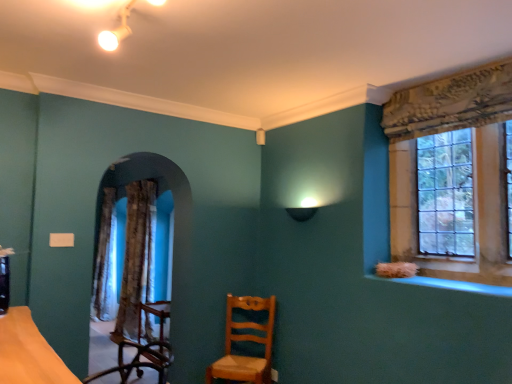
Question: Should I look upward or downward to see clear glass window at upper right?

Choices:
 (A) up
 (B) down

Answer: (B)

Question: Does light brown wood chair at center have a smaller size compared to textured brown curtain at left?

Choices:
 (A) yes
 (B) no

Answer: (A)

Question: Considering the relative sizes of light brown wood chair at center and textured brown curtain at left in the image provided, is light brown wood chair at center wider than textured brown curtain at left?

Choices:
 (A) yes
 (B) no

Answer: (A)

Question: Considering the relative positions of light brown wood chair at center and textured brown curtain at left in the image provided, is light brown wood chair at center to the left of textured brown curtain at left from the viewer's perspective?

Choices:
 (A) no
 (B) yes

Answer: (A)

Question: Would you consider light brown wood chair at center to be distant from textured brown curtain at left?

Choices:
 (A) no
 (B) yes

Answer: (A)

Question: Is the depth of light brown wood chair at center greater than that of textured brown curtain at left?

Choices:
 (A) no
 (B) yes

Answer: (A)

Question: Is the position of light brown wood chair at center less distant than that of textured brown curtain at left?

Choices:
 (A) no
 (B) yes

Answer: (B)

Question: Is light brown wood chair at center at the back of clear glass window at upper right?

Choices:
 (A) no
 (B) yes

Answer: (A)

Question: Is clear glass window at upper right facing towards light brown wood chair at center?

Choices:
 (A) no
 (B) yes

Answer: (A)

Question: Considering the relative positions of clear glass window at upper right and light brown wood chair at center in the image provided, is clear glass window at upper right behind light brown wood chair at center?

Choices:
 (A) no
 (B) yes

Answer: (A)

Question: From a real-world perspective, does clear glass window at upper right stand above light brown wood chair at center?

Choices:
 (A) no
 (B) yes

Answer: (B)

Question: From the image's perspective, is clear glass window at upper right located above light brown wood chair at center?

Choices:
 (A) no
 (B) yes

Answer: (B)

Question: Could light brown wood chair at center be considered to be inside clear glass window at upper right?

Choices:
 (A) yes
 (B) no

Answer: (B)

Question: Is clear glass window at upper right completely or partially outside of blue glossy window sill at lower right?

Choices:
 (A) no
 (B) yes

Answer: (B)